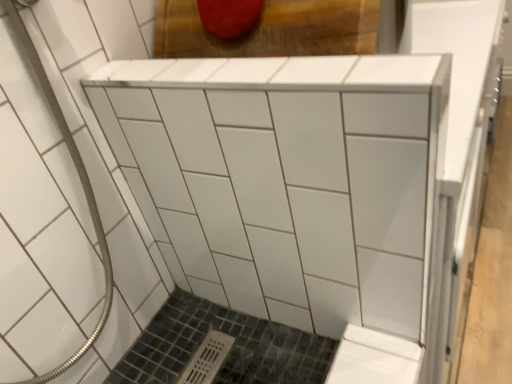
Question: Is point (16, 213) closer or farther from the camera than point (187, 102)?

Choices:
 (A) closer
 (B) farther

Answer: (B)

Question: From the image's perspective, relative to white glossy cabinet at center, is white glossy tile at center above or below?

Choices:
 (A) above
 (B) below

Answer: (B)

Question: From a real-world perspective, is white glossy tile at center positioned above or below white glossy cabinet at center?

Choices:
 (A) below
 (B) above

Answer: (B)

Question: Considering their positions, is white glossy cabinet at center located in front of or behind white glossy tile at center?

Choices:
 (A) front
 (B) behind

Answer: (B)

Question: From their relative heights in the image, would you say white glossy cabinet at center is taller or shorter than white glossy tile at center?

Choices:
 (A) short
 (B) tall

Answer: (A)

Question: From the image's perspective, is white glossy cabinet at center positioned above or below white glossy tile at center?

Choices:
 (A) above
 (B) below

Answer: (A)

Question: Would you say white glossy cabinet at center is inside or outside white glossy tile at center?

Choices:
 (A) outside
 (B) inside

Answer: (A)